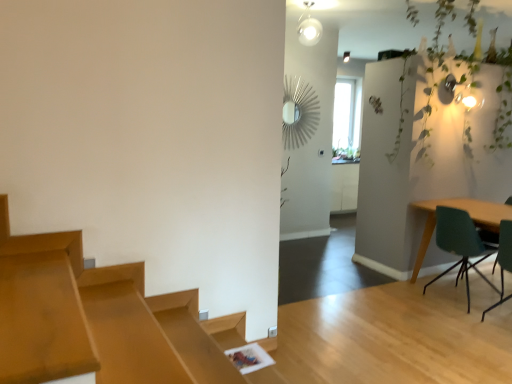
This screenshot has height=384, width=512. What do you see at coordinates (347, 120) in the screenshot? I see `clear glass window at upper center` at bounding box center [347, 120].

At what (x,y) coordinates should I click in order to perform the action: click on clear glass window at upper center. Please return your answer as a coordinate pair (x, y). Image resolution: width=512 pixels, height=384 pixels. Looking at the image, I should click on [347, 120].

You are a GUI agent. You are given a task and a screenshot of the screen. Output one action in this format:
    pyautogui.click(x=<x>, y=<y>)
    Task: Click on the green fabric chair at right, the 2th chair viewed from the back
    
    Given the screenshot: What is the action you would take?
    pyautogui.click(x=503, y=258)

The width and height of the screenshot is (512, 384). I want to click on teal fabric chair at right, so click(x=488, y=238).

Describe the element at coordinates (488, 238) in the screenshot. I see `teal fabric chair at right` at that location.

This screenshot has height=384, width=512. What do you see at coordinates (448, 67) in the screenshot?
I see `green leafy plant at upper right` at bounding box center [448, 67].

You are a GUI agent. You are given a task and a screenshot of the screen. Output one action in this format:
    pyautogui.click(x=<x>, y=<y>)
    Task: Click on the clear glass window at upper center
    The image size is (512, 384).
    Given the screenshot: What is the action you would take?
    pyautogui.click(x=347, y=120)

Looking at the image, does clear glass window at upper center seem bigger or smaller compared to teal fabric chair at right?

Clearly, clear glass window at upper center is smaller in size than teal fabric chair at right.

What's the angular difference between clear glass window at upper center and teal fabric chair at right's facing directions?

The angular difference between clear glass window at upper center and teal fabric chair at right is 92.4 degrees.

Is clear glass window at upper center turned away from teal fabric chair at right?

No.

From the image's perspective, which one is positioned lower, clear glass window at upper center or teal fabric chair at right?

teal fabric chair at right is shown below in the image.

Consider the image. From the image's perspective, between teal fabric chair at right and green fabric chair at right, placed as the first chair when sorted from front to back, which one is located above?

From the image's view, teal fabric chair at right is above.

From a real-world perspective, which is physically below, teal fabric chair at right or green fabric chair at right, placed as the first chair when sorted from front to back?

teal fabric chair at right, from a real-world perspective.

Considering the sizes of objects teal fabric chair at right and green fabric chair at right, the 2th chair viewed from the back, in the image provided, who is wider, teal fabric chair at right or green fabric chair at right, the 2th chair viewed from the back,?

Wider between the two is teal fabric chair at right.

Which is closer, (480, 229) or (443, 224)?

Point (480, 229) appears to be closer to the viewer than point (443, 224).

Is teal fabric chair at right bigger than teal matte chair at right, arranged as the first chair when viewed from the back?

Yes.

Is teal fabric chair at right aimed at teal matte chair at right, arranged as the first chair when viewed from the back?

Yes, teal fabric chair at right is facing teal matte chair at right, arranged as the first chair when viewed from the back.

From the image's perspective, is teal fabric chair at right above or below teal matte chair at right, which ranks as the 2th chair in front-to-back order?

teal fabric chair at right is above teal matte chair at right, which ranks as the 2th chair in front-to-back order.

From a real-world perspective, does green leafy plant at upper right sit lower than clear glass window at upper center?

Incorrect, from a real-world perspective, green leafy plant at upper right is higher than clear glass window at upper center.

Is green leafy plant at upper right looking in the opposite direction of clear glass window at upper center?

green leafy plant at upper right does not have its back to clear glass window at upper center.

Which is behind, point (470, 61) or point (357, 153)?

The point (357, 153) is farther.

Would you say green leafy plant at upper right is a long distance from clear glass window at upper center?

Yes, green leafy plant at upper right is far from clear glass window at upper center.

Considering the sizes of objects teal matte chair at right, arranged as the first chair when viewed from the back, and teal fabric chair at right in the image provided, who is thinner, teal matte chair at right, arranged as the first chair when viewed from the back, or teal fabric chair at right?

Thinner between the two is teal matte chair at right, arranged as the first chair when viewed from the back.

In terms of size, does teal matte chair at right, arranged as the first chair when viewed from the back, appear bigger or smaller than teal fabric chair at right?

Clearly, teal matte chair at right, arranged as the first chair when viewed from the back, is smaller in size than teal fabric chair at right.

Would you say teal matte chair at right, arranged as the first chair when viewed from the back, contains teal fabric chair at right?

No, teal matte chair at right, arranged as the first chair when viewed from the back, does not contain teal fabric chair at right.

From the picture: Which is in front, teal matte chair at right, arranged as the first chair when viewed from the back, or teal fabric chair at right?

Positioned in front is teal matte chair at right, arranged as the first chair when viewed from the back.

In the scene shown: Is clear glass window at upper center facing towards green leafy plant at upper right?

No.

From the image's perspective, is clear glass window at upper center above green leafy plant at upper right?

Yes, from the image's perspective, clear glass window at upper center is on top of green leafy plant at upper right.

Who is taller, clear glass window at upper center or green leafy plant at upper right?

With more height is clear glass window at upper center.

Looking at this image, is clear glass window at upper center positioned far away from green leafy plant at upper right?

Yes, clear glass window at upper center is far from green leafy plant at upper right.

From a real-world perspective, is clear glass window at upper center on top of green fabric chair at right, placed as the first chair when sorted from front to back?

Yes, from a real-world perspective, clear glass window at upper center is over green fabric chair at right, placed as the first chair when sorted from front to back

Is clear glass window at upper center turned away from green fabric chair at right, the 2th chair viewed from the back?

No, green fabric chair at right, the 2th chair viewed from the back, is not at the back of clear glass window at upper center.

Who is bigger, clear glass window at upper center or green fabric chair at right, placed as the first chair when sorted from front to back?

With larger size is clear glass window at upper center.

You are a GUI agent. You are given a task and a screenshot of the screen. Output one action in this format:
    pyautogui.click(x=<x>, y=<y>)
    Task: Click on the armchair lying in front of the clear glass window at upper center
    
    Given the screenshot: What is the action you would take?
    pyautogui.click(x=488, y=238)

Locate an element on the screen. This screenshot has height=384, width=512. armchair above the green fabric chair at right, placed as the first chair when sorted from front to back (from the image's perspective) is located at coordinates (488, 238).

Based on their spatial positions, is green leafy plant at upper right or teal fabric chair at right further from clear glass window at upper center?

The object further to clear glass window at upper center is teal fabric chair at right.

When comparing their distances from green leafy plant at upper right, does teal fabric chair at right or teal matte chair at right, which ranks as the 2th chair in front-to-back order, seem further?

teal fabric chair at right is further to green leafy plant at upper right.

Estimate the real-world distances between objects in this image. Which object is further from teal matte chair at right, which ranks as the 2th chair in front-to-back order, green fabric chair at right, the 2th chair viewed from the back, or green leafy plant at upper right?

Based on the image, green leafy plant at upper right appears to be further to teal matte chair at right, which ranks as the 2th chair in front-to-back order.

Considering their positions, is green leafy plant at upper right positioned further to teal matte chair at right, which ranks as the 2th chair in front-to-back order, than green fabric chair at right, placed as the first chair when sorted from front to back?

Based on the image, green leafy plant at upper right appears to be further to teal matte chair at right, which ranks as the 2th chair in front-to-back order.

Considering their positions, is green fabric chair at right, the 2th chair viewed from the back, positioned closer to green leafy plant at upper right than clear glass window at upper center?

Based on the image, green fabric chair at right, the 2th chair viewed from the back, appears to be nearer to green leafy plant at upper right.

Looking at the image, which one is located closer to green fabric chair at right, the 2th chair viewed from the back, clear glass window at upper center or green leafy plant at upper right?

Among the two, green leafy plant at upper right is located nearer to green fabric chair at right, the 2th chair viewed from the back.

From the image, which object appears to be farther from clear glass window at upper center, teal fabric chair at right or green leafy plant at upper right?

teal fabric chair at right is further to clear glass window at upper center.

Which object lies nearer to the anchor point green fabric chair at right, placed as the first chair when sorted from front to back, clear glass window at upper center or teal fabric chair at right?

teal fabric chair at right is positioned closer to the anchor green fabric chair at right, placed as the first chair when sorted from front to back.

At what (x,y) coordinates should I click in order to perform the action: click on armchair between teal matte chair at right, arranged as the first chair when viewed from the back, and clear glass window at upper center in the front-back direction. Please return your answer as a coordinate pair (x, y). This screenshot has height=384, width=512. Looking at the image, I should click on (488, 238).

Identify the location of vegetation between teal matte chair at right, which ranks as the 2th chair in front-to-back order, and clear glass window at upper center in the front-back direction. (448, 67).

Where is `vegetation located between green fabric chair at right, placed as the first chair when sorted from front to back, and clear glass window at upper center in the depth direction`? The width and height of the screenshot is (512, 384). vegetation located between green fabric chair at right, placed as the first chair when sorted from front to back, and clear glass window at upper center in the depth direction is located at coordinates (448, 67).

Where is `chair between green leafy plant at upper right and green fabric chair at right, the 2th chair viewed from the back, in the up-down direction`? The image size is (512, 384). chair between green leafy plant at upper right and green fabric chair at right, the 2th chair viewed from the back, in the up-down direction is located at coordinates (460, 244).